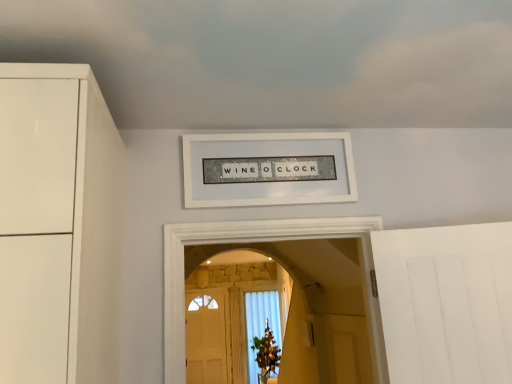
This screenshot has width=512, height=384. I want to click on white glittery sign at center, so click(267, 169).

Measure the distance between white glittery sign at center and camera.

A distance of 5.51 feet exists between white glittery sign at center and camera.

The height and width of the screenshot is (384, 512). What do you see at coordinates (267, 169) in the screenshot? I see `white glittery sign at center` at bounding box center [267, 169].

Describe the element at coordinates (279, 60) in the screenshot. I see `white matte cloud at upper center` at that location.

The image size is (512, 384). Identify the location of white matte cloud at upper center. (279, 60).

I want to click on white glittery sign at center, so click(x=267, y=169).

Would you say white matte cloud at upper center is to the left or to the right of white glittery sign at center in the picture?

Clearly, white matte cloud at upper center is on the right of white glittery sign at center in the image.

Is the depth of white matte cloud at upper center less than that of white glittery sign at center?

Yes, white matte cloud at upper center is in front of white glittery sign at center.

Which point is more forward, (205, 65) or (310, 177)?

Point (205, 65)

From the image's perspective, who appears lower, white matte cloud at upper center or white glittery sign at center?

white glittery sign at center is shown below in the image.

From a real-world perspective, is white matte cloud at upper center physically above white glittery sign at center?

Indeed, from a real-world perspective, white matte cloud at upper center stands above white glittery sign at center.

Which object is wider, white matte cloud at upper center or white glittery sign at center?

With larger width is white matte cloud at upper center.

Considering the sizes of objects white matte cloud at upper center and white glittery sign at center in the image provided, who is taller, white matte cloud at upper center or white glittery sign at center?

white glittery sign at center.

Between white matte cloud at upper center and white glittery sign at center, which one has smaller size?

white glittery sign at center is smaller.

Is white glittery sign at center located within white matte cloud at upper center?

That's incorrect, white glittery sign at center is not inside white matte cloud at upper center.

From the picture: Is there a large distance between white matte cloud at upper center and white glittery sign at center?

Actually, white matte cloud at upper center and white glittery sign at center are a little close together.

Is white matte cloud at upper center oriented towards white glittery sign at center?

No, white matte cloud at upper center is not oriented towards white glittery sign at center.

What's the angular difference between white matte cloud at upper center and white glittery sign at center's facing directions?

The angular difference between white matte cloud at upper center and white glittery sign at center is 180 degrees.

How distant is white matte cloud at upper center from white glittery sign at center?

white matte cloud at upper center and white glittery sign at center are 13.72 inches apart.

Identify the location of picture frame that appears below the white matte cloud at upper center (from the image's perspective). (267, 169).

Can you confirm if white glittery sign at center is positioned to the left of white matte cloud at upper center?

Yes, white glittery sign at center is to the left of white matte cloud at upper center.

Is white glittery sign at center positioned behind white matte cloud at upper center?

That is True.

Is point (218, 166) positioned in front of point (121, 83)?

No, (218, 166) is further to viewer.

Based on the photo, from the image's perspective, relative to white matte cloud at upper center, is white glittery sign at center above or below?

white glittery sign at center is situated lower than white matte cloud at upper center in the image.

From a real-world perspective, is white glittery sign at center positioned above or below white matte cloud at upper center?

white glittery sign at center is below white matte cloud at upper center.

Can you confirm if white glittery sign at center is thinner than white matte cloud at upper center?

Indeed, white glittery sign at center has a lesser width compared to white matte cloud at upper center.

Consider the image. From their relative heights in the image, would you say white glittery sign at center is taller or shorter than white matte cloud at upper center?

In the image, white glittery sign at center appears to be taller than white matte cloud at upper center.

Which of these two, white glittery sign at center or white matte cloud at upper center, is bigger?

white matte cloud at upper center is bigger.

Can we say white glittery sign at center lies outside white matte cloud at upper center?

white glittery sign at center is positioned outside white matte cloud at upper center.

Is white glittery sign at center far from white matte cloud at upper center?

white glittery sign at center is actually quite close to white matte cloud at upper center.

Is white glittery sign at center oriented away from white matte cloud at upper center?

No.

Identify the location of picture frame below the white matte cloud at upper center (from a real-world perspective). The width and height of the screenshot is (512, 384). (267, 169).

You are a GUI agent. You are given a task and a screenshot of the screen. Output one action in this format:
    pyautogui.click(x=<x>, y=<y>)
    Task: Click on the cloud on the right of white glittery sign at center
    This screenshot has width=512, height=384.
    Given the screenshot: What is the action you would take?
    tap(279, 60)

Identify the location of picture frame that appears behind the white matte cloud at upper center. pos(267,169).